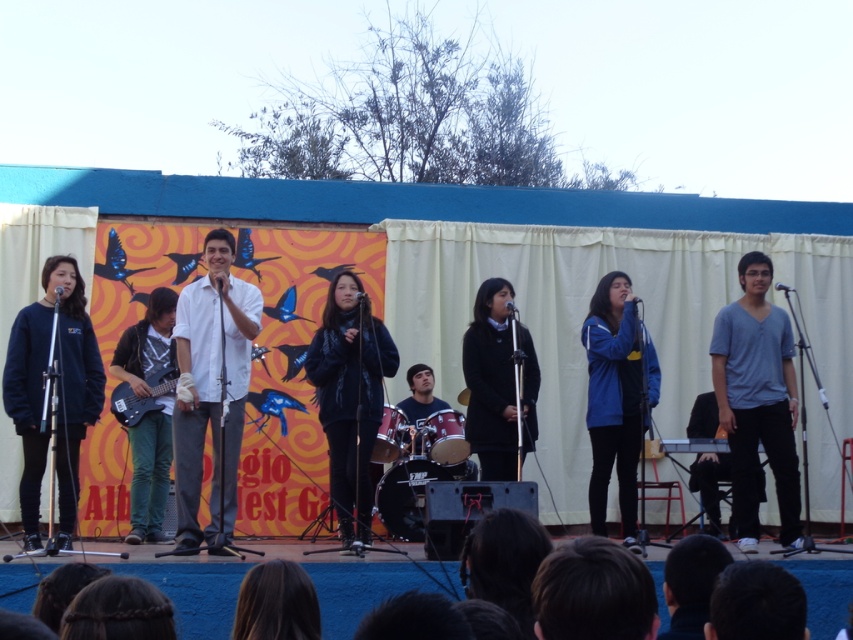
You are a photographer standing behind the stage. You want to take a photo of the dark blue sweatshirt at left and the blue fabric jacket at center so that both are in focus. The camera you are using has a depth of field that can cover up to 4 meters. Will both subjects be in focus?

The distance between the dark blue sweatshirt at left and the blue fabric jacket at center is 3.99 meters, which is within the camera s 4 meter depth of field. Therefore, both subjects will be in focus.

You are a photographer trying to capture a clear shot of the blue fabric jacket at center without the dark blue sweatshirt at left blocking it. Can you adjust your angle to achieve this?

The dark blue sweatshirt at left is positioned over the blue fabric jacket at center, so adjusting your angle to look from the right side might allow you to capture the blue fabric jacket at center without obstruction.